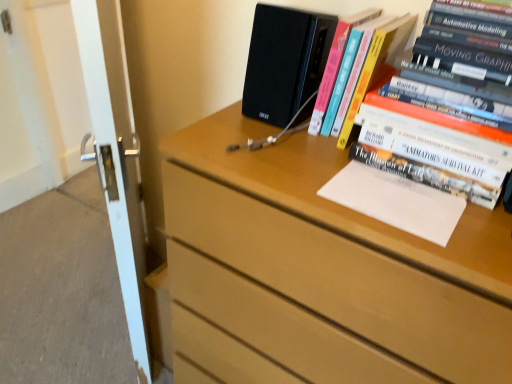
In order to click on free location in front of hardcover book at upper right, which appears as the second book when viewed from the right in this screenshot , I will do `click(306, 157)`.